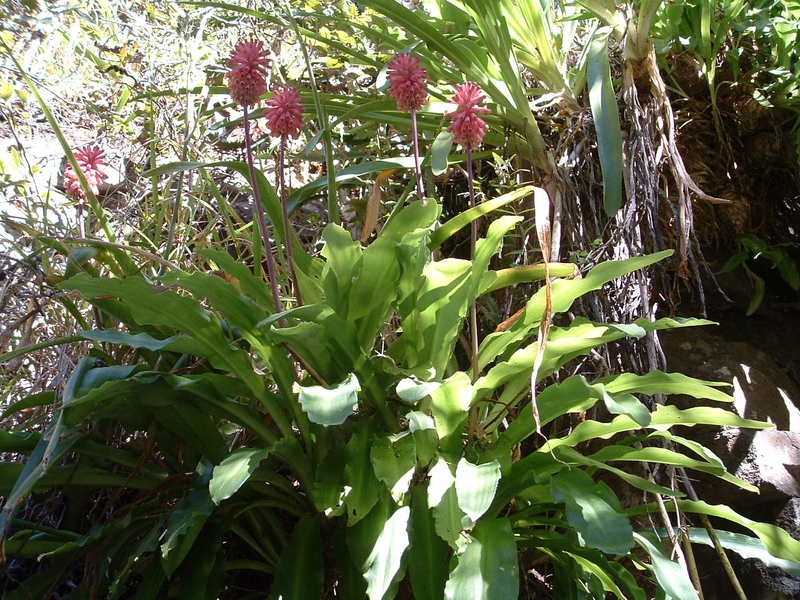
I want to click on 2 plants, so click(357, 305), click(480, 457).